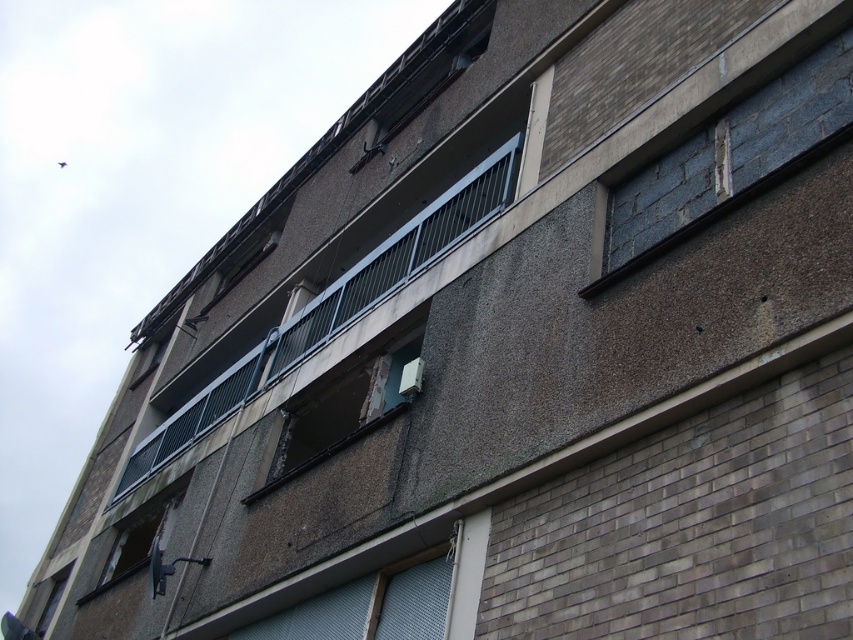
You are an inspector assessing the building. You notice two windows needing immediate repair. The blue concrete window at upper right and the rusty metal window at lower left. Which of these windows is narrower?

The blue concrete window at upper right has a lesser width compared to the rusty metal window at lower left, so it is narrower.